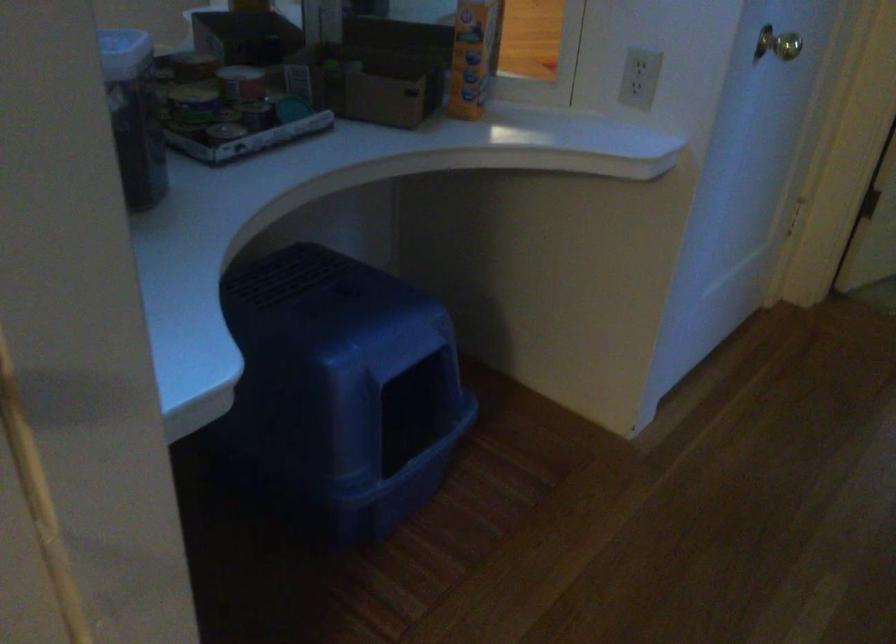
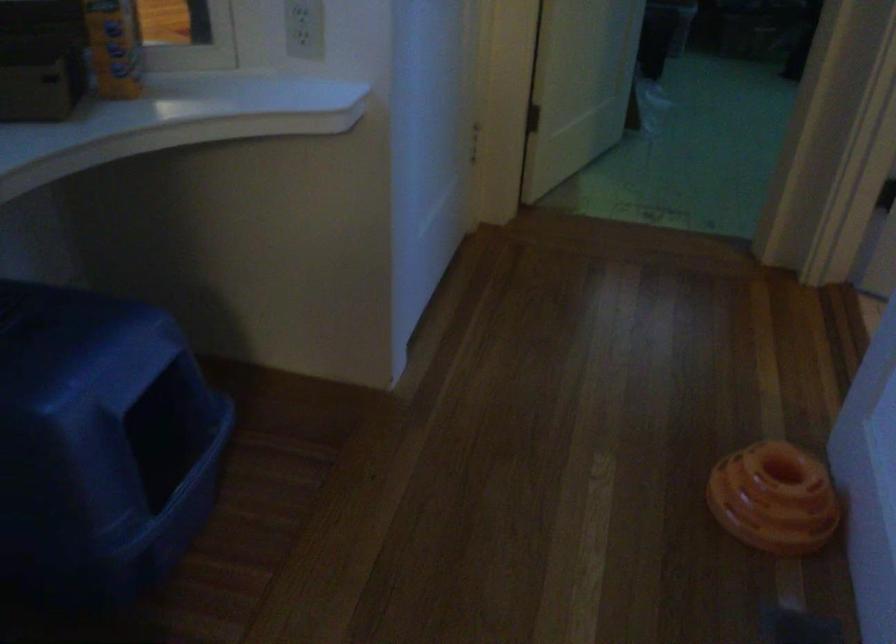
Question: How did the camera likely rotate?

Choices:
 (A) Left
 (B) Right
 (C) Up
 (D) Down

Answer: (B)